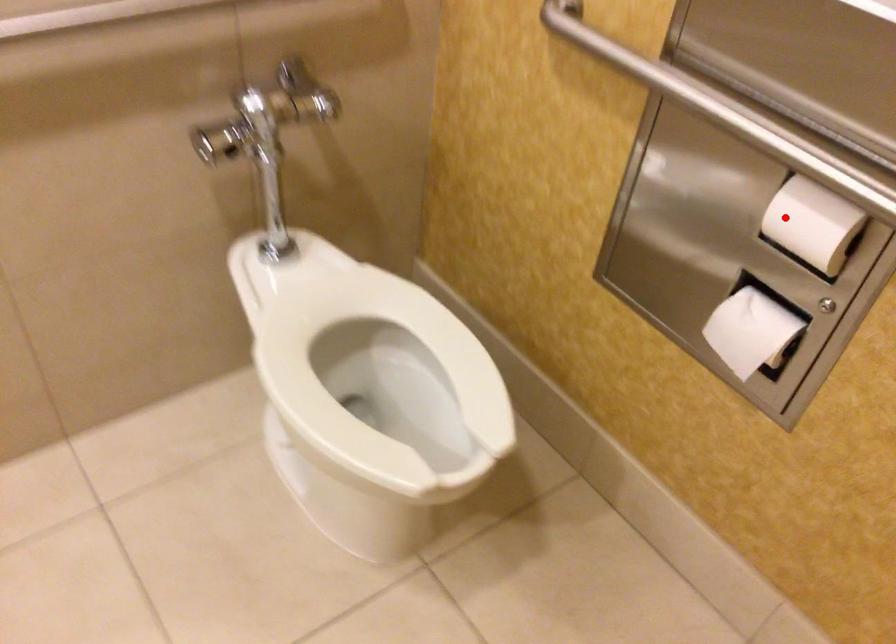
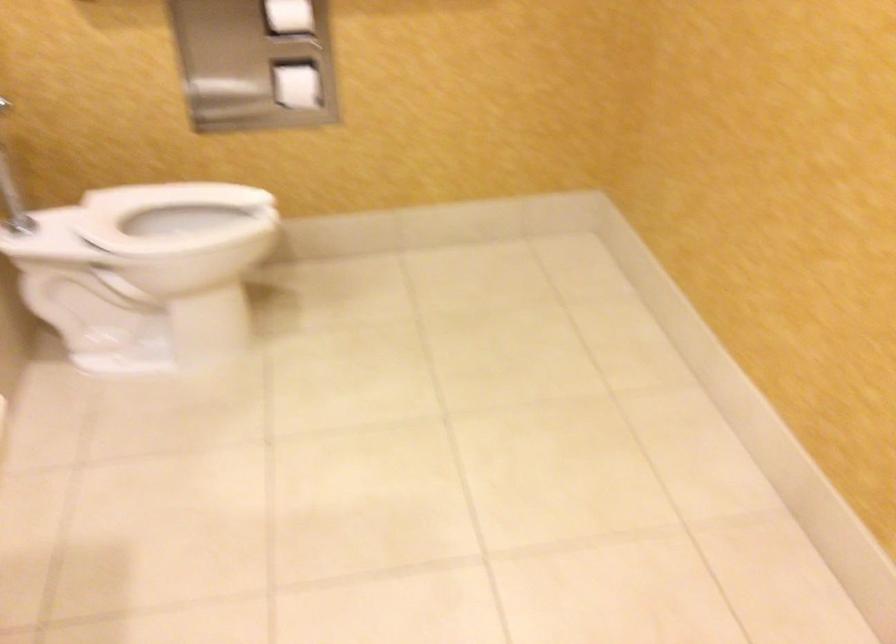
Locate, in the second image, the point that corresponds to the highlighted location in the first image.

(289, 15)